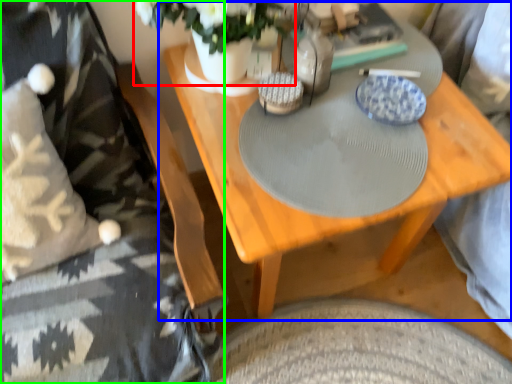
Question: Based on their relative distances, which object is nearer to floral arrangement (highlighted by a red box)? Choose from table (highlighted by a blue box) and bedding (highlighted by a green box).

Choices:
 (A) table
 (B) bedding

Answer: (A)